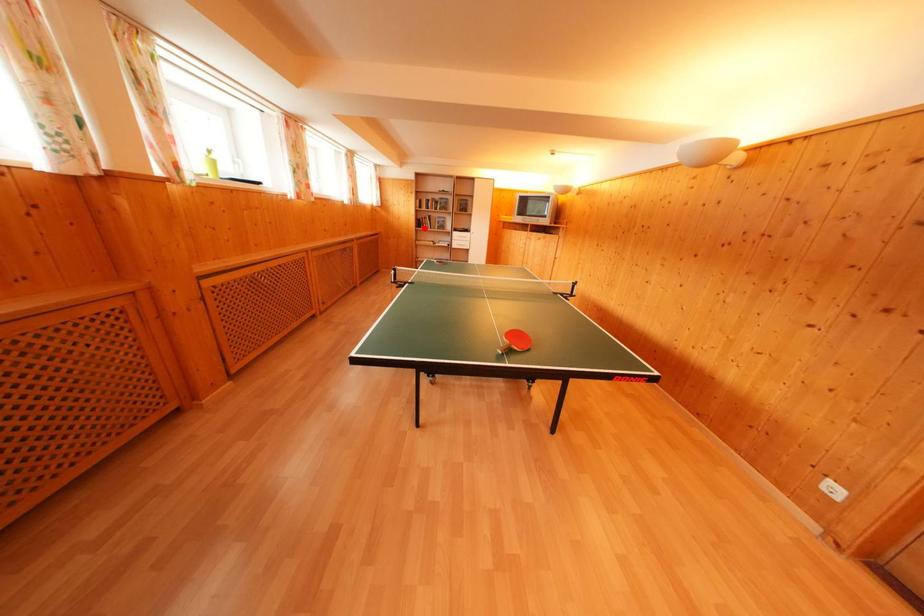
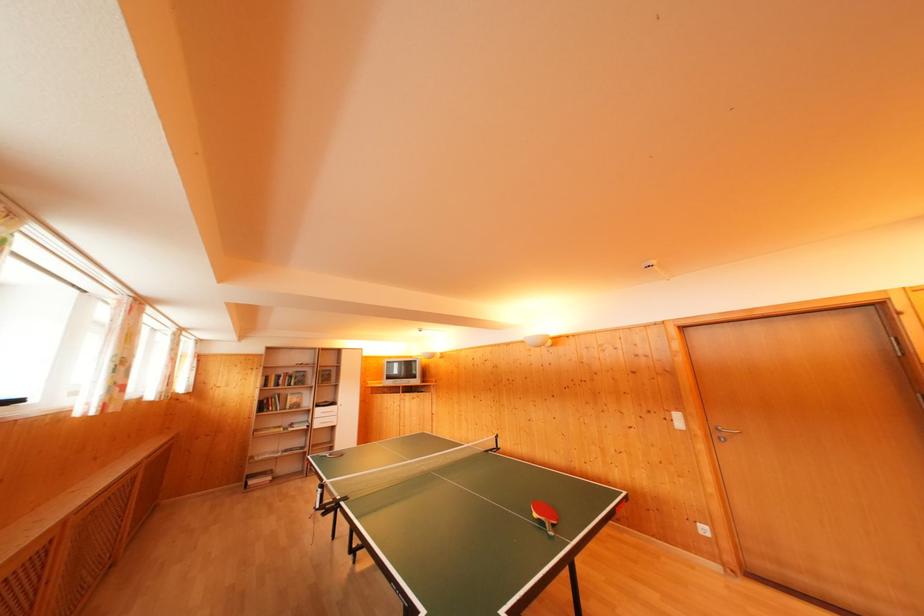
Question: I am providing you with two images of the same scene from different viewpoints. A red point is shown in image1. For the corresponding object point in image2, is it positioned nearer or farther from the camera?

Choices:
 (A) Nearer
 (B) Farther

Answer: (B)